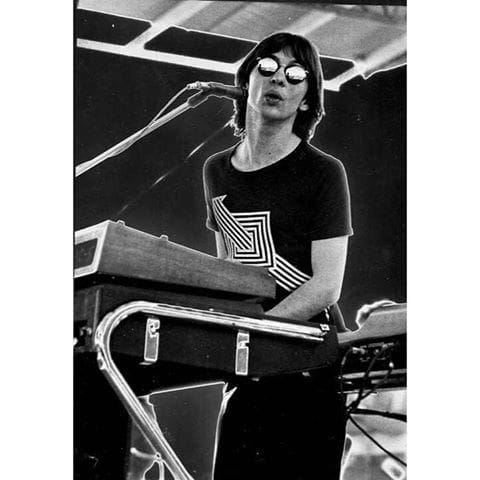
At what (x,y) coordinates should I click in order to perform the action: click on stand. Please return your answer as a coordinate pair (x, y). Looking at the image, I should click on (188, 97).